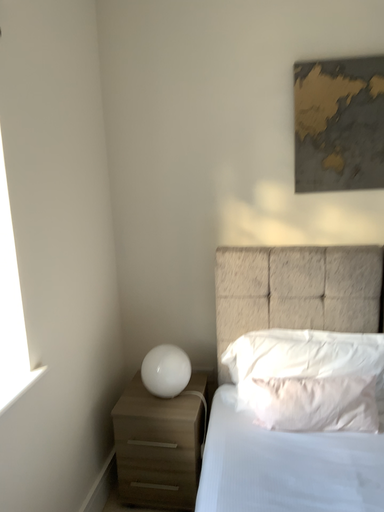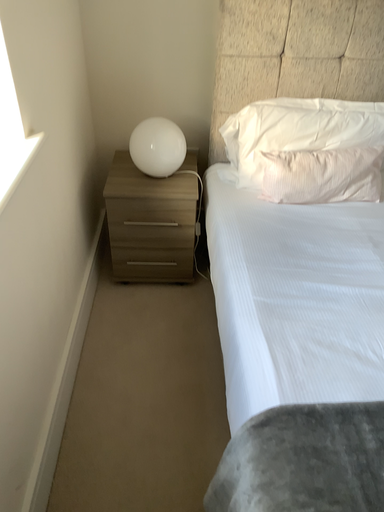
Question: Which way did the camera rotate in the video?

Choices:
 (A) rotated downward
 (B) rotated upward

Answer: (A)